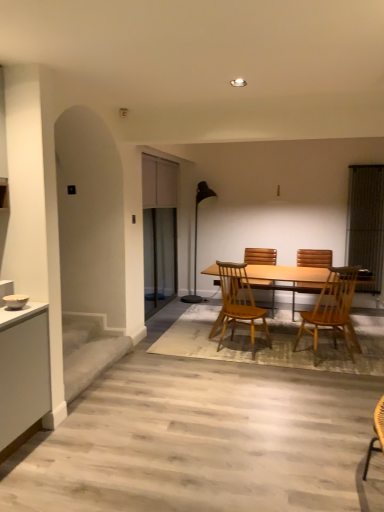
The width and height of the screenshot is (384, 512). What do you see at coordinates (196, 238) in the screenshot? I see `black metal floor lamp at center` at bounding box center [196, 238].

You are a GUI agent. You are given a task and a screenshot of the screen. Output one action in this format:
    pyautogui.click(x=<x>, y=<y>)
    Task: Click on the brown leather chair at center, placed as the third chair when sorted from front to back
    
    Given the screenshot: What is the action you would take?
    pyautogui.click(x=314, y=258)

Find the location of a particular element. The height and width of the screenshot is (512, 384). black mesh screen at right is located at coordinates (366, 222).

Locate an element on the screen. The width and height of the screenshot is (384, 512). clear glass screen door at center is located at coordinates (159, 231).

The height and width of the screenshot is (512, 384). I want to click on matte gray cabinet at upper center, so click(x=159, y=182).

Considering the sizes of clear glass screen door at center and black metal floor lamp at center in the image, is clear glass screen door at center wider or thinner than black metal floor lamp at center?

clear glass screen door at center is thinner than black metal floor lamp at center.

From the image's perspective, would you say clear glass screen door at center is shown under black metal floor lamp at center?

No.

Which object is more forward, clear glass screen door at center or black metal floor lamp at center?

Positioned in front is clear glass screen door at center.

Consider the image. Considering the relative sizes of black mesh screen at right and light brown wooden chair at center, which is counted as the second chair, starting from the front, in the image provided, is black mesh screen at right taller than light brown wooden chair at center, which is counted as the second chair, starting from the front,?

Yes.

From a real-world perspective, who is located higher, black mesh screen at right or light brown wooden chair at center, which is counted as the second chair, starting from the front?

black mesh screen at right is physically above.

From the image's perspective, relative to light brown wooden chair at center, which ranks as the 3th chair in back-to-front order, is black mesh screen at right above or below?

From the image's perspective, black mesh screen at right appears above light brown wooden chair at center, which ranks as the 3th chair in back-to-front order.

Looking at this image, are black mesh screen at right and light brown wooden chair at center, which is counted as the second chair, starting from the front, making contact?

No, black mesh screen at right is not in contact with light brown wooden chair at center, which is counted as the second chair, starting from the front.

Is brown leather chair at center, which ranks as the 2th chair in back-to-front order, further to the viewer compared to light brown wooden table at center?

Yes, it is.

Is light brown wooden table at center at the back of brown leather chair at center, which ranks as the 2th chair in back-to-front order?

No, light brown wooden table at center is not at the back of brown leather chair at center, which ranks as the 2th chair in back-to-front order.

Is brown leather chair at center, placed as the third chair when sorted from front to back, outside of light brown wooden table at center?

Yes.

From a real-world perspective, does brown leather chair at center, placed as the third chair when sorted from front to back, sit lower than black metal floor lamp at center?

Yes, from a real-world perspective, brown leather chair at center, placed as the third chair when sorted from front to back, is under black metal floor lamp at center.

From the image's perspective, between brown leather chair at center, which ranks as the 2th chair in back-to-front order, and black metal floor lamp at center, who is located below?

brown leather chair at center, which ranks as the 2th chair in back-to-front order, appears lower in the image.

Which of these two, brown leather chair at center, placed as the third chair when sorted from front to back, or black metal floor lamp at center, is thinner?

Thinner between the two is black metal floor lamp at center.

Does point (331, 263) appear closer or farther from the camera than point (200, 192)?

Point (331, 263) appears to be closer to the viewer than point (200, 192).

Where is `screen door behind the light brown wooden table at center`? Image resolution: width=384 pixels, height=512 pixels. screen door behind the light brown wooden table at center is located at coordinates (159, 231).

Which object is thinner, light brown wooden table at center or clear glass screen door at center?

clear glass screen door at center is thinner.

Does light brown wooden table at center have a greater height compared to clear glass screen door at center?

In fact, light brown wooden table at center may be shorter than clear glass screen door at center.

Is light brown wooden table at center not close to clear glass screen door at center?

Yes, light brown wooden table at center and clear glass screen door at center are located far from each other.

Consider the image. Is wooden at center, the 4th chair positioned from the front, wider than wooden chair at center, the 4th chair in the back-to-front sequence?

Yes.

Does wooden at center, placed as the 1th chair when sorted from back to front, touch wooden chair at center, acting as the 1th chair starting from the front?

No, wooden at center, placed as the 1th chair when sorted from back to front, is not making contact with wooden chair at center, acting as the 1th chair starting from the front.

Can you confirm if wooden at center, placed as the 1th chair when sorted from back to front, is smaller than wooden chair at center, acting as the 1th chair starting from the front?

Incorrect, wooden at center, placed as the 1th chair when sorted from back to front, is not smaller in size than wooden chair at center, acting as the 1th chair starting from the front.

Is point (381, 182) closer or farther from the camera than point (196, 298)?

Point (381, 182).

Is black mesh screen at right with black metal floor lamp at center?

No, black mesh screen at right is not in contact with black metal floor lamp at center.

Identify the location of window screen on the right of black metal floor lamp at center. The width and height of the screenshot is (384, 512). (366, 222).

Between black mesh screen at right and black metal floor lamp at center, which one has larger width?

Wider between the two is black metal floor lamp at center.

The height and width of the screenshot is (512, 384). What are the coordinates of `screen door that appears in front of the black metal floor lamp at center` in the screenshot? It's located at (159, 231).

Find the location of `window screen above the light brown wooden chair at center, which is counted as the second chair, starting from the front (from a real-world perspective)`. window screen above the light brown wooden chair at center, which is counted as the second chair, starting from the front (from a real-world perspective) is located at coordinates (366, 222).

Based on their spatial positions, is black mesh screen at right or matte gray cabinet at upper center further from brown leather chair at center, which ranks as the 2th chair in back-to-front order?

The object further to brown leather chair at center, which ranks as the 2th chair in back-to-front order, is matte gray cabinet at upper center.

In the scene shown: Estimate the real-world distances between objects in this image. Which object is further from brown leather chair at center, which ranks as the 2th chair in back-to-front order, light brown wooden chair at center, which is counted as the second chair, starting from the front, or light brown wooden table at center?

light brown wooden chair at center, which is counted as the second chair, starting from the front, lies further to brown leather chair at center, which ranks as the 2th chair in back-to-front order, than the other object.

Considering their positions, is clear glass screen door at center positioned closer to wooden at center, placed as the 1th chair when sorted from back to front, than wooden chair at center, acting as the 1th chair starting from the front?

wooden chair at center, acting as the 1th chair starting from the front, is positioned closer to the anchor wooden at center, placed as the 1th chair when sorted from back to front.

From the image, which object appears to be farther from brown leather chair at center, which ranks as the 2th chair in back-to-front order, clear glass screen door at center or wooden at center, placed as the 1th chair when sorted from back to front?

Among the two, clear glass screen door at center is located further to brown leather chair at center, which ranks as the 2th chair in back-to-front order.

Estimate the real-world distances between objects in this image. Which object is closer to light brown wooden table at center, black mesh screen at right or black metal floor lamp at center?

Among the two, black mesh screen at right is located nearer to light brown wooden table at center.

From the image, which object appears to be nearer to light brown wooden table at center, black mesh screen at right or brown leather chair at center, which ranks as the 2th chair in back-to-front order?

Among the two, brown leather chair at center, which ranks as the 2th chair in back-to-front order, is located nearer to light brown wooden table at center.

Estimate the real-world distances between objects in this image. Which object is closer to black mesh screen at right, light brown wooden table at center or black metal floor lamp at center?

light brown wooden table at center lies closer to black mesh screen at right than the other object.

Which object lies nearer to the anchor point brown leather chair at center, which ranks as the 2th chair in back-to-front order, black metal floor lamp at center or wooden at center, placed as the 1th chair when sorted from back to front?

wooden at center, placed as the 1th chair when sorted from back to front, lies closer to brown leather chair at center, which ranks as the 2th chair in back-to-front order, than the other object.

Identify the location of cabinetry between clear glass screen door at center and wooden at center, the 4th chair positioned from the front, from left to right. The height and width of the screenshot is (512, 384). (159, 182).

Locate an element on the screen. kitchen & dining room table between matte gray cabinet at upper center and black mesh screen at right is located at coordinates click(287, 278).

Find the location of a particular element. This screenshot has width=384, height=512. kitchen & dining room table between light brown wooden chair at center, which is counted as the second chair, starting from the front, and wooden chair at center, acting as the 1th chair starting from the front, in the horizontal direction is located at coordinates (287, 278).

Where is `kitchen & dining room table situated between clear glass screen door at center and brown leather chair at center, placed as the third chair when sorted from front to back, from left to right`? The image size is (384, 512). kitchen & dining room table situated between clear glass screen door at center and brown leather chair at center, placed as the third chair when sorted from front to back, from left to right is located at coordinates (287, 278).